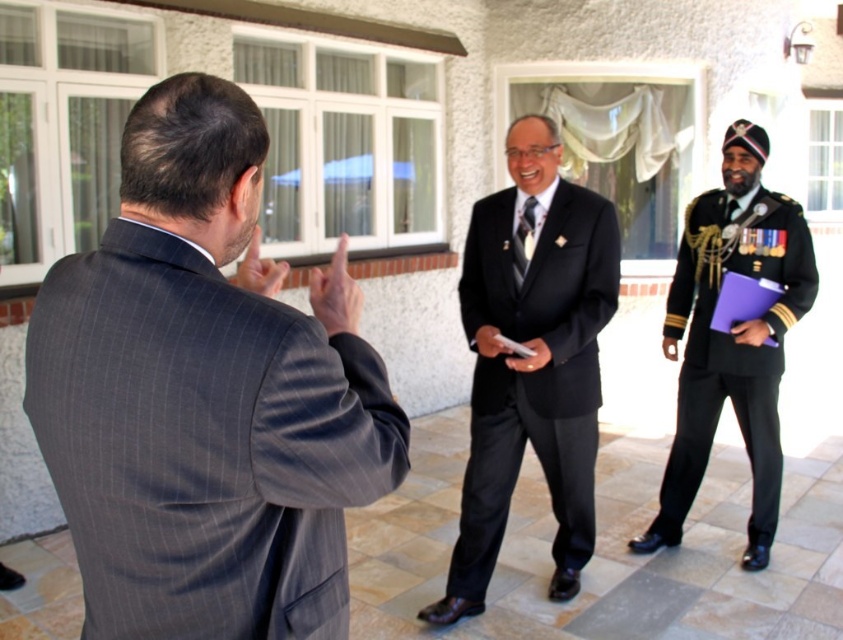
Where is `black pinstripe suit at center`? black pinstripe suit at center is located at coordinates (530, 358).

Can you confirm if black pinstripe suit at center is positioned to the left of black uniform at right?

Indeed, black pinstripe suit at center is positioned on the left side of black uniform at right.

Is point (452, 579) positioned after point (801, 234)?

No, it is not.

Where is `black pinstripe suit at center`? black pinstripe suit at center is located at coordinates (530, 358).

Describe the element at coordinates (205, 396) in the screenshot. I see `gray pinstripe suit at center` at that location.

Based on the photo, can you confirm if gray pinstripe suit at center is bigger than black pinstripe suit at center?

No, gray pinstripe suit at center is not bigger than black pinstripe suit at center.

Does point (321, 520) come behind point (550, 486)?

No, (321, 520) is closer to viewer.

This screenshot has width=843, height=640. In order to click on gray pinstripe suit at center in this screenshot , I will do `click(205, 396)`.

How far apart are gray pinstripe suit at center and black uniform at right?

A distance of 9.83 feet exists between gray pinstripe suit at center and black uniform at right.

Looking at this image, does gray pinstripe suit at center have a larger size compared to black uniform at right?

No.

What do you see at coordinates (205, 396) in the screenshot? This screenshot has width=843, height=640. I see `gray pinstripe suit at center` at bounding box center [205, 396].

This screenshot has width=843, height=640. What are the coordinates of `gray pinstripe suit at center` in the screenshot? It's located at (205, 396).